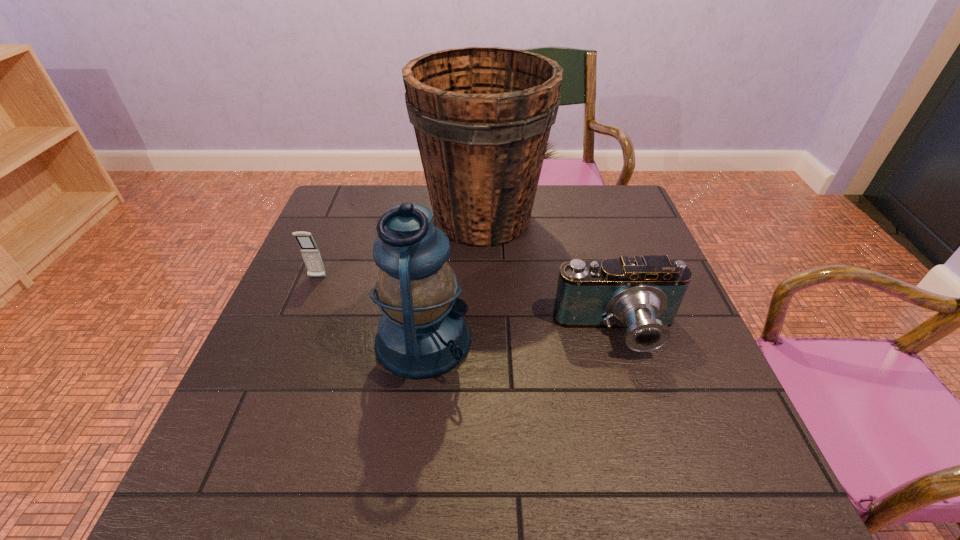
The image size is (960, 540). Identify the location of unoccupied area between the cellular telephone and the second tallest object. (371, 308).

Where is `free spot between the cellular telephone and the third shortest object`? The image size is (960, 540). free spot between the cellular telephone and the third shortest object is located at coordinates (371, 308).

What are the coordinates of `empty space between the leftmost object and the second tallest object` in the screenshot? It's located at (371, 308).

Identify the location of vacant space that is in between the camcorder and the third shortest object. The width and height of the screenshot is (960, 540). tap(520, 336).

The width and height of the screenshot is (960, 540). I want to click on free spot between the camcorder and the farthest object, so click(550, 276).

In order to click on object that is the second closest one to the camcorder in this screenshot , I will do `click(422, 333)`.

Choose which object is the third nearest neighbor to the third shortest object. Please provide its 2D coordinates. Your answer should be formatted as a tuple, i.e. [(x, y)], where the tuple contains the x and y coordinates of a point satisfying the conditions above.

[(643, 294)]

You are a GUI agent. You are given a task and a screenshot of the screen. Output one action in this format:
    pyautogui.click(x=<x>, y=<y>)
    Task: Click on the vacant area that satisfies the following two spatial constraints: 1. on the front side of the bucket; 2. on the face of the lantern
    The width and height of the screenshot is (960, 540).
    Given the screenshot: What is the action you would take?
    pyautogui.click(x=483, y=340)

You are a GUI agent. You are given a task and a screenshot of the screen. Output one action in this format:
    pyautogui.click(x=<x>, y=<y>)
    Task: Click on the free space that satisfies the following two spatial constraints: 1. on the front-facing side of the camcorder; 2. on the face of the second tallest object
    The width and height of the screenshot is (960, 540).
    Given the screenshot: What is the action you would take?
    pyautogui.click(x=619, y=340)